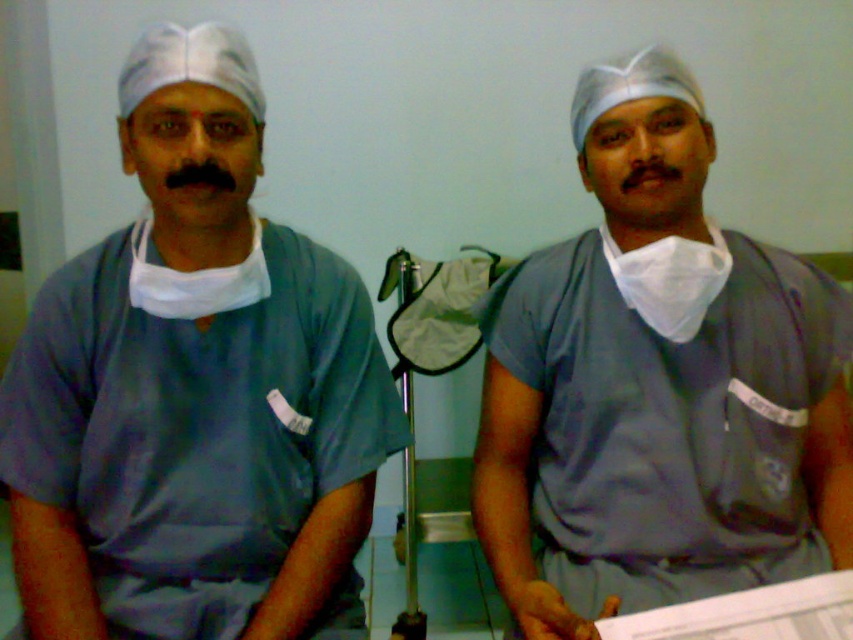
You are a patient in a hospital and see two medical professionals wearing scrubs. One is wearing matte blue scrubs at center and the other gray matte scrubs at center. Which one is positioned to the left?

The matte blue scrubs at center is to the left of gray matte scrubs at center.

You are a patient in a hospital room and see two medical professionals wearing scrubs. The first is wearing matte blue scrubs at center, and the second is wearing gray matte scrubs at center. Which set of scrubs is covering the other?

The matte blue scrubs at center is positioned over gray matte scrubs at center, so the blue scrubs are covering the gray ones.